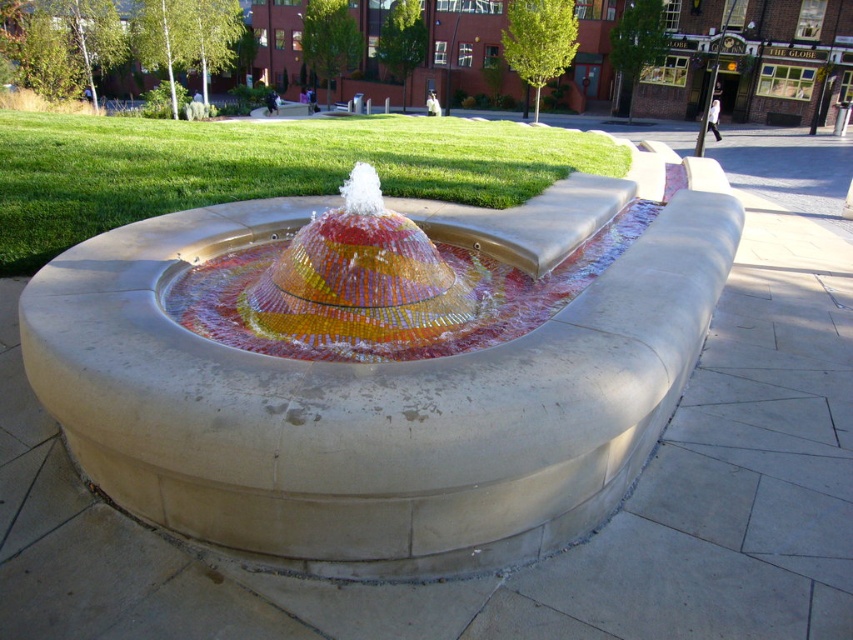
You are a photographer planning to capture the mosaic tile fountain at center and the multicolored mosaic water at center in a single frame. Based on their sizes, which object should you focus on to ensure both are clearly visible in the photo?

The mosaic tile fountain at center is bigger than the multicolored mosaic water at center, so focusing on the mosaic tile fountain at center will help ensure both are clearly visible in the photo.

You are a photographer aiming to capture the entire fountain and its water flow in one shot. Given that your camera can only focus on objects within a 1.5 meter height range, will you be able to capture both the mosaic tile fountain at center and the multicolored mosaic water at center without adjusting your focus?

The mosaic tile fountain at center has a greater height compared to the multicolored mosaic water at center. Since the camera can focus on objects within a 1.5 meter height range, if the height difference between the two is within 1.5 meters, they can be captured in one shot. However, if the fountain is significantly taller than the water spray, adjustments might be needed. The description only states the fountain is taller, but doesn